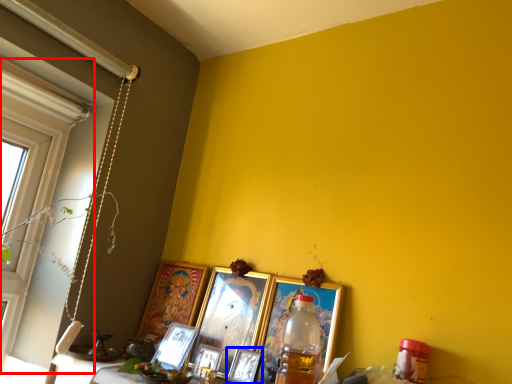
Question: Which object appears closest to the camera in this image, window (highlighted by a red box) or picture frame (highlighted by a blue box)?

Choices:
 (A) window
 (B) picture frame

Answer: (A)